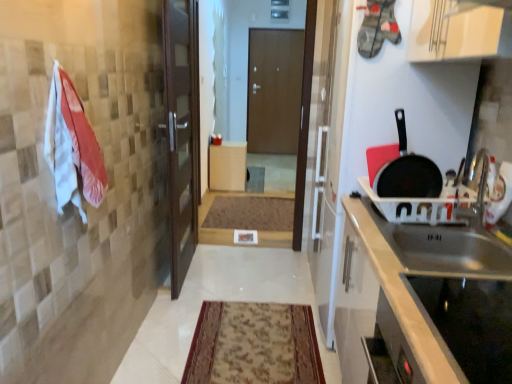
What is the approximate width of stainless steel sink at right?

The width of stainless steel sink at right is 18.54 inches.

Where is `white cotton towel at left`? The image size is (512, 384). white cotton towel at left is located at coordinates 72,146.

At what (x,y) coordinates should I click in order to perform the action: click on white matte cabinet at center. Please return your answer as a coordinate pair (x, y). The width and height of the screenshot is (512, 384). Looking at the image, I should click on (227, 166).

What do you see at coordinates (254, 345) in the screenshot? I see `carpeted rug at center, the 1th mat from the front` at bounding box center [254, 345].

At what (x,y) coordinates should I click in order to perform the action: click on brown matte door at center. Please return your answer as a coordinate pair (x, y). The width and height of the screenshot is (512, 384). Looking at the image, I should click on (274, 90).

Measure the distance between brown carpet at center, which appears as the 2th mat when viewed from the front, and stainless steel sink at right.

They are 2.57 meters apart.

Is brown carpet at center, which appears as the 2th mat when viewed from the front, facing away from stainless steel sink at right?

No, brown carpet at center, which appears as the 2th mat when viewed from the front, is not facing the opposite direction of stainless steel sink at right.

Where is `countertop on the right of the brown carpet at center, the first mat positioned from the back`? The image size is (512, 384). countertop on the right of the brown carpet at center, the first mat positioned from the back is located at coordinates click(x=429, y=300).

Considering the sizes of objects brown carpet at center, which appears as the 2th mat when viewed from the front, and stainless steel sink at right in the image provided, who is taller, brown carpet at center, which appears as the 2th mat when viewed from the front, or stainless steel sink at right?

Standing taller between the two is stainless steel sink at right.

Which is correct: stainless steel sink at right is inside black matte frying pan at right, or outside of it?

stainless steel sink at right is outside black matte frying pan at right.

How far apart are stainless steel sink at right and black matte frying pan at right?

A distance of 14.78 inches exists between stainless steel sink at right and black matte frying pan at right.

Is stainless steel sink at right not near black matte frying pan at right?

They are positioned close to each other.

From a real-world perspective, is stainless steel sink at right physically located above or below black matte frying pan at right?

From a real-world perspective, stainless steel sink at right is physically below black matte frying pan at right.

Can you see white cotton towel at left touching brown matte door at center?

No, white cotton towel at left is not next to brown matte door at center.

From a real-world perspective, which is physically below, white cotton towel at left or brown matte door at center?

brown matte door at center.

From the picture: From the image's perspective, which one is positioned lower, white cotton towel at left or brown matte door at center?

white cotton towel at left appears lower in the image.

Between white cotton towel at left and brown matte door at center, which one has larger size?

Bigger between the two is brown matte door at center.

Which object is positioned more to the right, black matte frying pan at right or white matte cabinet at center?

black matte frying pan at right is more to the right.

Can white matte cabinet at center be found inside black matte frying pan at right?

No.

Is black matte frying pan at right smaller than white matte cabinet at center?

Indeed, black matte frying pan at right has a smaller size compared to white matte cabinet at center.

Can you confirm if black matte frying pan at right is thinner than white matte cabinet at center?

Indeed, black matte frying pan at right has a lesser width compared to white matte cabinet at center.

Is black glass cooktop at lower right not near brown carpet at center, the 2th mat positioned from the bottom?

black glass cooktop at lower right is far away from brown carpet at center, the 2th mat positioned from the bottom.

From a real-world perspective, is black glass cooktop at lower right under brown carpet at center, the 2th mat positioned from the bottom?

Actually, black glass cooktop at lower right is physically above brown carpet at center, the 2th mat positioned from the bottom, in the real world.

Which of these two, black glass cooktop at lower right or brown carpet at center, the first mat positioned from the back, is wider?

Wider between the two is brown carpet at center, the first mat positioned from the back.

Is brown carpet at center, the 2th mat positioned from the bottom, surrounded by black glass cooktop at lower right?

Definitely not — brown carpet at center, the 2th mat positioned from the bottom, is not inside black glass cooktop at lower right.

Based on the photo, would you consider brown carpet at center, the first mat positioned from the back, to be distant from black glass cooktop at lower right?

Absolutely, brown carpet at center, the first mat positioned from the back, is distant from black glass cooktop at lower right.

From a real-world perspective, is brown carpet at center, the first mat positioned from the back, positioned above or below black glass cooktop at lower right?

In terms of real-world spatial position, brown carpet at center, the first mat positioned from the back, is below black glass cooktop at lower right.

How many degrees apart are the facing directions of brown carpet at center, which appears as the 2th mat when viewed from the front, and black glass cooktop at lower right?

brown carpet at center, which appears as the 2th mat when viewed from the front, and black glass cooktop at lower right are facing 91.5 degrees away from each other.

Which object is positioned more to the left, brown carpet at center, which appears as the 2th mat when viewed from the front, or black glass cooktop at lower right?

Positioned to the left is brown carpet at center, which appears as the 2th mat when viewed from the front.

From the image's perspective, is carpeted rug at center, positioned as the first mat in bottom-to-top order, beneath stainless steel sink at right?

Yes, from the image's perspective, carpeted rug at center, positioned as the first mat in bottom-to-top order, is beneath stainless steel sink at right.

Who is bigger, carpeted rug at center, placed as the second mat when sorted from back to front, or stainless steel sink at right?

Bigger between the two is stainless steel sink at right.

Does carpeted rug at center, positioned as the first mat in bottom-to-top order, appear on the right side of stainless steel sink at right?

No, carpeted rug at center, positioned as the first mat in bottom-to-top order, is not to the right of stainless steel sink at right.

This screenshot has width=512, height=384. In order to click on countertop lying below the brown carpet at center, the 2th mat positioned from the bottom (from the image's perspective) in this screenshot , I will do `click(429, 300)`.

Image resolution: width=512 pixels, height=384 pixels. I want to click on frying pan that appears on the left of stainless steel sink at right, so click(x=408, y=172).

From the image, which object appears to be farther from carpeted rug at center, the 1th mat from the front, white cotton towel at left or brown carpet at center, the first mat viewed from the top?

brown carpet at center, the first mat viewed from the top, is further to carpeted rug at center, the 1th mat from the front.

From the image, which object appears to be nearer to black glass cooktop at lower right, black matte frying pan at right or carpeted rug at center, acting as the 2th mat starting from the top?

Among the two, black matte frying pan at right is located nearer to black glass cooktop at lower right.

Looking at the image, which one is located closer to white matte cabinet at center, brown carpet at center, the 2th mat positioned from the bottom, or black matte frying pan at right?

brown carpet at center, the 2th mat positioned from the bottom, is positioned closer to the anchor white matte cabinet at center.

When comparing their distances from brown matte door at center, does carpeted rug at center, placed as the second mat when sorted from back to front, or black glass cooktop at lower right seem closer?

carpeted rug at center, placed as the second mat when sorted from back to front, is closer to brown matte door at center.

In the scene shown: When comparing their distances from black glass cooktop at lower right, does black matte frying pan at right or stainless steel sink at right seem further?

Among the two, black matte frying pan at right is located further to black glass cooktop at lower right.

From the image, which object appears to be farther from brown matte door at center, carpeted rug at center, positioned as the first mat in bottom-to-top order, or brown carpet at center, the 2th mat positioned from the bottom?

Based on the image, carpeted rug at center, positioned as the first mat in bottom-to-top order, appears to be further to brown matte door at center.

From the image, which object appears to be nearer to black matte frying pan at right, carpeted rug at center, positioned as the first mat in bottom-to-top order, or brown carpet at center, the first mat positioned from the back?

Based on the image, carpeted rug at center, positioned as the first mat in bottom-to-top order, appears to be nearer to black matte frying pan at right.

Based on their spatial positions, is brown carpet at center, which appears as the 2th mat when viewed from the front, or black glass cooktop at lower right closer to stainless steel sink at right?

black glass cooktop at lower right is closer to stainless steel sink at right.

Where is `frying pan between stainless steel sink at right and white matte cabinet at center in the front-back direction`? frying pan between stainless steel sink at right and white matte cabinet at center in the front-back direction is located at coordinates (408, 172).

This screenshot has width=512, height=384. I want to click on appliance situated between white cotton towel at left and stainless steel sink at right from left to right, so click(x=471, y=323).

Find the location of a particular element. Image resolution: width=512 pixels, height=384 pixels. laundry between stainless steel sink at right and brown matte door at center along the z-axis is located at coordinates (72, 146).

The height and width of the screenshot is (384, 512). I want to click on frying pan located between white cotton towel at left and brown carpet at center, the first mat positioned from the back, in the depth direction, so click(408, 172).